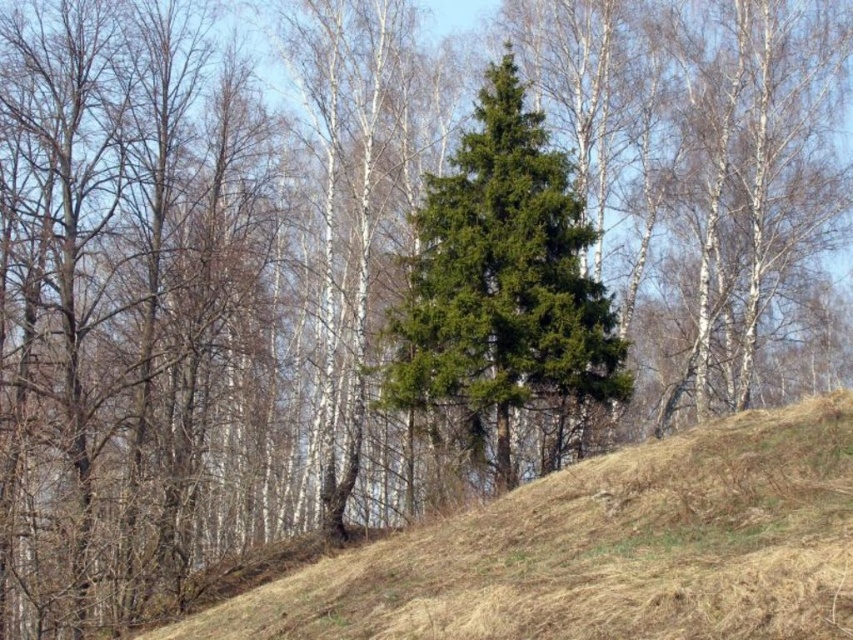
Question: Which point is farther to the camera?

Choices:
 (A) (498, 266)
 (B) (360, 620)

Answer: (A)

Question: Is brown grassy hillside at lower left above green needle-like tree at center?

Choices:
 (A) no
 (B) yes

Answer: (A)

Question: Which object is closer to the camera taking this photo?

Choices:
 (A) green needle-like tree at center
 (B) brown grassy hillside at lower left

Answer: (B)

Question: Can you confirm if brown grassy hillside at lower left is bigger than green needle-like tree at center?

Choices:
 (A) no
 (B) yes

Answer: (B)

Question: Is brown grassy hillside at lower left closer to camera compared to green needle-like tree at center?

Choices:
 (A) yes
 (B) no

Answer: (A)